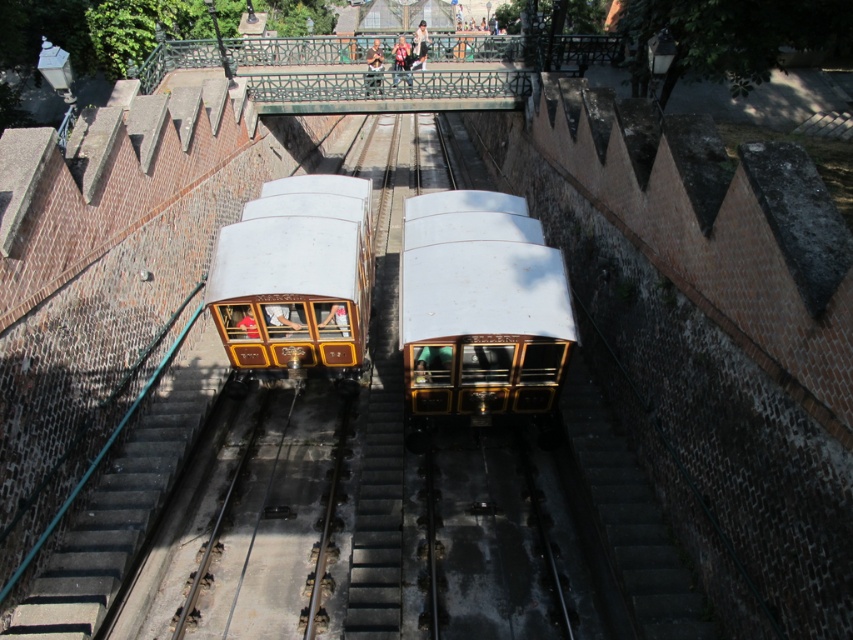
You are a passenger on the white polished wood train at center and want to get off at the next station. However, the tunnel is narrow and there is another train ahead. Can you safely pass through the tunnel without colliding with the gold polished wood train at center?

The white polished wood train at center is in front of the gold polished wood train at center, meaning it is closer to you. Since you are on the white polished wood train at center, which is already ahead of the gold one, you can safely proceed to the next station without collision as long as both trains maintain their current positions.

You are a passenger on the white polished wood train at center and want to board the gold polished wood train at center. Which direction should you walk to reach it?

The white polished wood train at center is positioned on the right side of the gold polished wood train at center, so you should walk to your left to reach it.